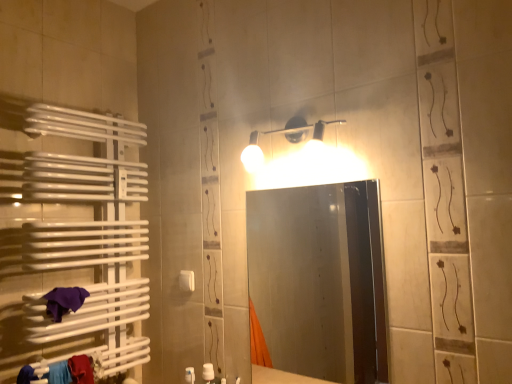
Question: Is smooth glass mirror at center at the left side of purple cloth at lower left?

Choices:
 (A) yes
 (B) no

Answer: (B)

Question: Is smooth glass mirror at center wider than purple cloth at lower left?

Choices:
 (A) yes
 (B) no

Answer: (B)

Question: Is smooth glass mirror at center thinner than purple cloth at lower left?

Choices:
 (A) no
 (B) yes

Answer: (B)

Question: Is smooth glass mirror at center positioned behind purple cloth at lower left?

Choices:
 (A) yes
 (B) no

Answer: (B)

Question: Considering the relative positions of smooth glass mirror at center and purple cloth at lower left in the image provided, is smooth glass mirror at center in front of purple cloth at lower left?

Choices:
 (A) no
 (B) yes

Answer: (B)

Question: In terms of height, does matte white light fixture at upper center look taller or shorter compared to purple cloth at lower left?

Choices:
 (A) short
 (B) tall

Answer: (B)

Question: Is matte white light fixture at upper center situated inside purple cloth at lower left or outside?

Choices:
 (A) inside
 (B) outside

Answer: (B)

Question: From the image's perspective, is matte white light fixture at upper center positioned above or below purple cloth at lower left?

Choices:
 (A) above
 (B) below

Answer: (A)

Question: Is matte white light fixture at upper center bigger or smaller than purple cloth at lower left?

Choices:
 (A) small
 (B) big

Answer: (B)

Question: Does point (287, 311) appear closer or farther from the camera than point (68, 291)?

Choices:
 (A) closer
 (B) farther

Answer: (B)

Question: From a real-world perspective, relative to purple cloth at lower left, is smooth glass mirror at center vertically above or below?

Choices:
 (A) below
 (B) above

Answer: (B)

Question: From the image's perspective, is smooth glass mirror at center located above or below purple cloth at lower left?

Choices:
 (A) above
 (B) below

Answer: (A)

Question: Is smooth glass mirror at center situated inside purple cloth at lower left or outside?

Choices:
 (A) outside
 (B) inside

Answer: (A)

Question: Looking at their shapes, would you say white plastic towel bar at lower left is wider or thinner than smooth glass mirror at center?

Choices:
 (A) thin
 (B) wide

Answer: (A)

Question: From a real-world perspective, is white plastic towel bar at lower left positioned above or below smooth glass mirror at center?

Choices:
 (A) above
 (B) below

Answer: (B)